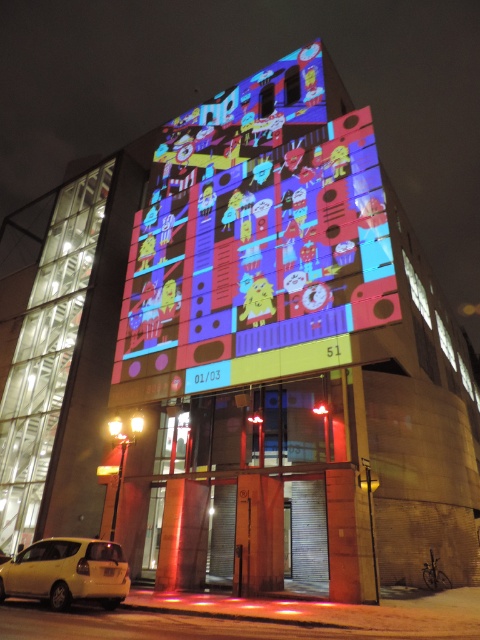
You are standing in front of the building and want to take a photo of the yellow matte car at lower left without the colorful digital art at center appearing in the frame. Based on their positions, is this possible?

The colorful digital art at center is to the right of the yellow matte car at lower left, so if you position yourself to the left side of the car and aim the camera away from the center, you can capture the yellow matte car at lower left without the colorful digital art at center in the frame.

You are a photographer standing at the front of the building. You want to capture a photo that includes both the colorful digital art at center and the yellow matte car at lower left. Based on their positions, can you frame the shot so both are visible in the same photo?

The colorful digital art at center is located above the yellow matte car at lower left, so yes, you can frame the shot to include both by positioning the camera to capture the upper and lower parts of the scene where both objects are visible.